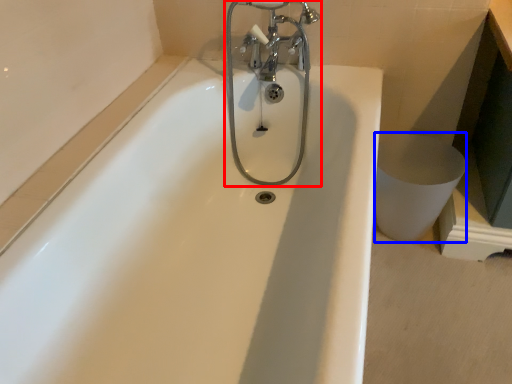
Question: Among these objects, which one is nearest to the camera, tap (highlighted by a red box) or toilet bowl (highlighted by a blue box)?

Choices:
 (A) tap
 (B) toilet bowl

Answer: (A)